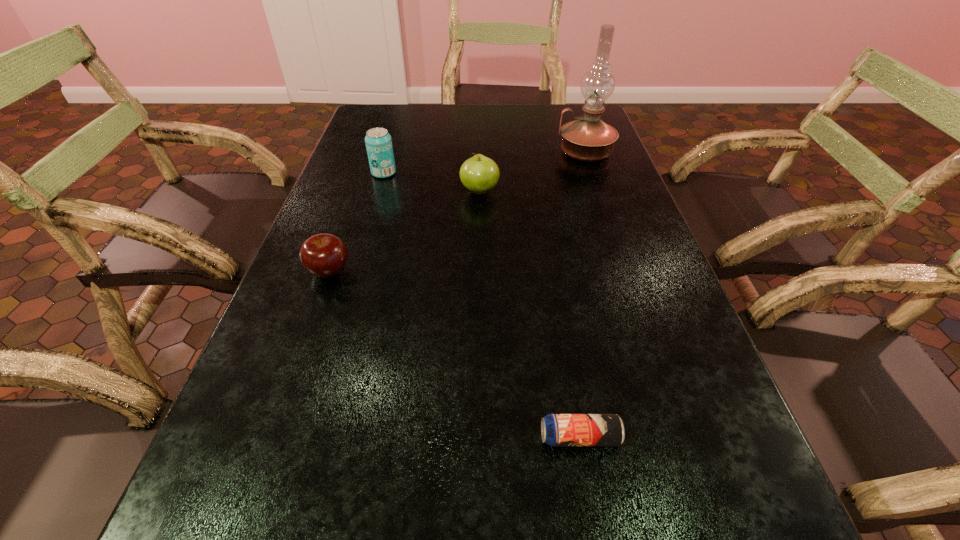
Locate an element on the screen. Image resolution: width=960 pixels, height=540 pixels. the tallest object is located at coordinates pyautogui.click(x=588, y=138).

This screenshot has width=960, height=540. What are the coordinates of `oil lamp` in the screenshot? It's located at (588, 138).

The height and width of the screenshot is (540, 960). I want to click on the farther beer can, so click(x=378, y=141).

You are a GUI agent. You are given a task and a screenshot of the screen. Output one action in this format:
    pyautogui.click(x=<x>, y=<y>)
    Task: Click on the taller beer can
    The height and width of the screenshot is (540, 960).
    Given the screenshot: What is the action you would take?
    pyautogui.click(x=378, y=141)

Where is `the right apple`? This screenshot has width=960, height=540. the right apple is located at coordinates (479, 174).

Where is `the third nearest object`? This screenshot has width=960, height=540. the third nearest object is located at coordinates (479, 174).

Image resolution: width=960 pixels, height=540 pixels. In order to click on the nearer apple in this screenshot , I will do `click(324, 255)`.

In order to click on the second shortest object in this screenshot , I will do `click(324, 255)`.

The image size is (960, 540). Identify the location of the second object from right to left. (558, 430).

You are a GUI agent. You are given a task and a screenshot of the screen. Output one action in this format:
    pyautogui.click(x=<x>, y=<y>)
    Task: Click on the nearer beer can
    
    Given the screenshot: What is the action you would take?
    pyautogui.click(x=558, y=430)